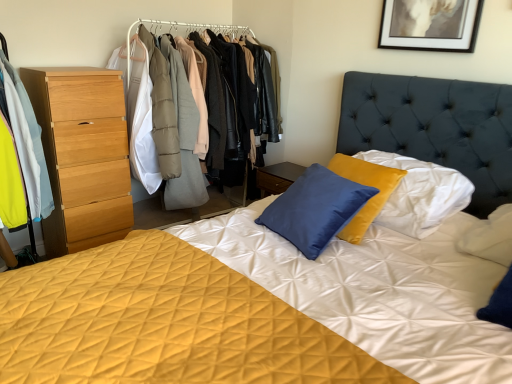
Question: Should I look upward or downward to see light wood chest of drawers at left?

Choices:
 (A) up
 (B) down

Answer: (A)

Question: Is light wood chest of drawers at left further to camera compared to wooden dresser at left?

Choices:
 (A) no
 (B) yes

Answer: (A)

Question: Is light wood chest of drawers at left in front of wooden dresser at left?

Choices:
 (A) yes
 (B) no

Answer: (A)

Question: From the image's perspective, is light wood chest of drawers at left on wooden dresser at left?

Choices:
 (A) no
 (B) yes

Answer: (A)

Question: Is light wood chest of drawers at left bigger than wooden dresser at left?

Choices:
 (A) no
 (B) yes

Answer: (A)

Question: Could you tell me if light wood chest of drawers at left is turned towards wooden dresser at left?

Choices:
 (A) yes
 (B) no

Answer: (B)

Question: Are light wood chest of drawers at left and wooden dresser at left far apart?

Choices:
 (A) yes
 (B) no

Answer: (B)

Question: From a real-world perspective, is light wood chest of drawers at left positioned over light blue fabric coat at left based on gravity?

Choices:
 (A) yes
 (B) no

Answer: (B)

Question: Is light wood chest of drawers at left directly adjacent to light blue fabric coat at left?

Choices:
 (A) yes
 (B) no

Answer: (B)

Question: Does light wood chest of drawers at left turn towards light blue fabric coat at left?

Choices:
 (A) no
 (B) yes

Answer: (A)

Question: Is light wood chest of drawers at left to the right of light blue fabric coat at left from the viewer's perspective?

Choices:
 (A) yes
 (B) no

Answer: (A)

Question: Would you say light wood chest of drawers at left contains light blue fabric coat at left?

Choices:
 (A) no
 (B) yes

Answer: (A)

Question: Considering the relative sizes of light wood chest of drawers at left and light blue fabric coat at left in the image provided, is light wood chest of drawers at left wider than light blue fabric coat at left?

Choices:
 (A) yes
 (B) no

Answer: (B)

Question: Is wooden dresser at left bigger than light blue fabric coat at left?

Choices:
 (A) yes
 (B) no

Answer: (A)